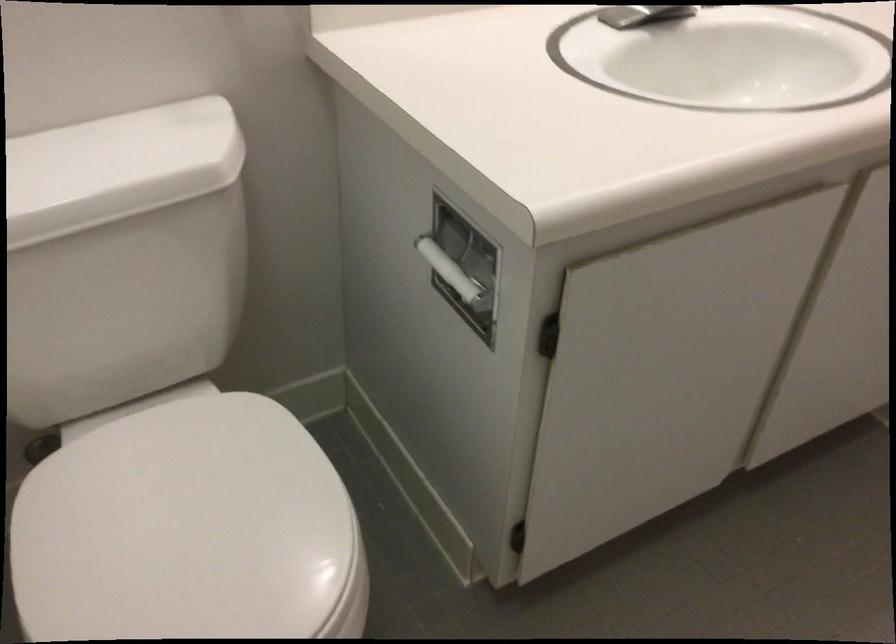
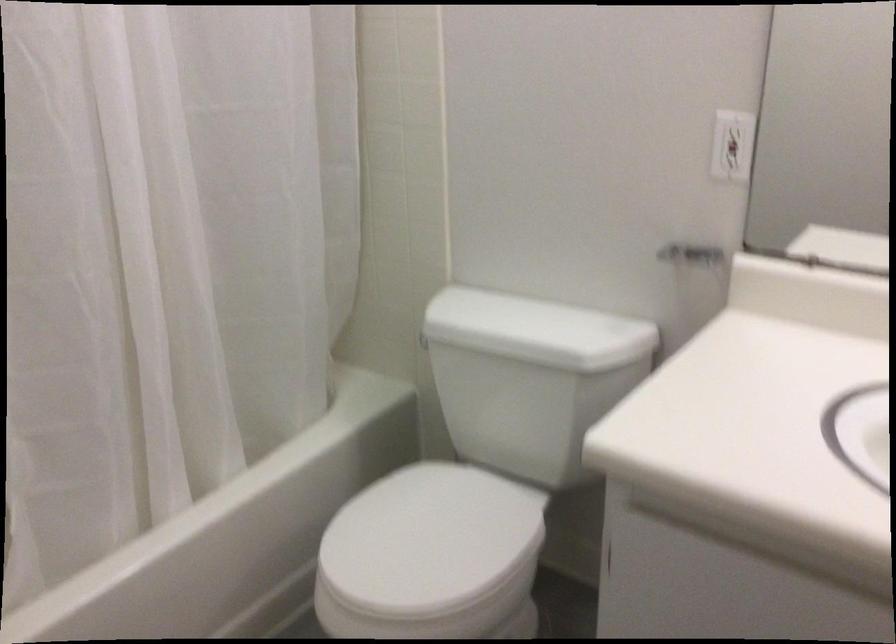
Find the pixel in the second image that matches point (237, 527) in the first image.

(429, 540)